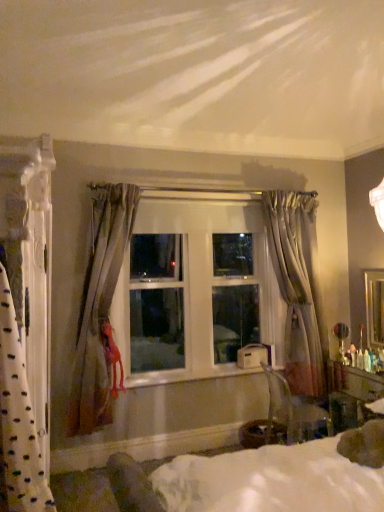
Question: Is sheer gray curtain at right, the first curtain positioned from the back, positioned behind white painted wood at center?

Choices:
 (A) yes
 (B) no

Answer: (A)

Question: Is there a large distance between sheer gray curtain at right, the 3th curtain in the left-to-right sequence, and white painted wood at center?

Choices:
 (A) yes
 (B) no

Answer: (B)

Question: Does sheer gray curtain at right, which appears as the 1th curtain when viewed from the right, lie in front of white painted wood at center?

Choices:
 (A) yes
 (B) no

Answer: (B)

Question: Considering the relative sizes of sheer gray curtain at right, the third curtain positioned from the front, and white painted wood at center in the image provided, is sheer gray curtain at right, the third curtain positioned from the front, shorter than white painted wood at center?

Choices:
 (A) no
 (B) yes

Answer: (A)

Question: Does sheer gray curtain at right, the third curtain positioned from the front, have a smaller size compared to white painted wood at center?

Choices:
 (A) yes
 (B) no

Answer: (B)

Question: Can you confirm if sheer gray curtain at right, which appears as the 1th curtain when viewed from the right, is positioned to the right of white painted wood at center?

Choices:
 (A) yes
 (B) no

Answer: (A)

Question: From a real-world perspective, does wooden glossy vanity at lower right stand above sheer gray curtain at right, the 3th curtain in the left-to-right sequence?

Choices:
 (A) no
 (B) yes

Answer: (A)

Question: Does wooden glossy vanity at lower right have a larger size compared to sheer gray curtain at right, the 3th curtain in the left-to-right sequence?

Choices:
 (A) no
 (B) yes

Answer: (A)

Question: Is wooden glossy vanity at lower right not within sheer gray curtain at right, the 3th curtain in the left-to-right sequence?

Choices:
 (A) yes
 (B) no

Answer: (A)

Question: Considering the relative sizes of wooden glossy vanity at lower right and sheer gray curtain at right, the third curtain positioned from the front, in the image provided, is wooden glossy vanity at lower right taller than sheer gray curtain at right, the third curtain positioned from the front,?

Choices:
 (A) no
 (B) yes

Answer: (A)

Question: Are wooden glossy vanity at lower right and sheer gray curtain at right, the 3th curtain in the left-to-right sequence, far apart?

Choices:
 (A) no
 (B) yes

Answer: (A)

Question: From the image's perspective, is wooden glossy vanity at lower right located above sheer gray curtain at right, the third curtain positioned from the front?

Choices:
 (A) yes
 (B) no

Answer: (B)

Question: Does white textured curtain at left, which is counted as the first curtain, starting from the left, come behind transparent plastic chair at lower right?

Choices:
 (A) no
 (B) yes

Answer: (A)